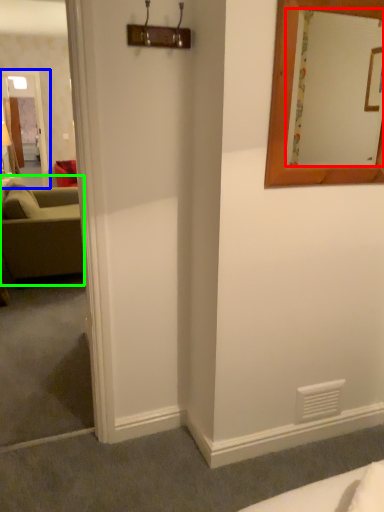
Question: Based on their relative distances, which object is nearer to mirror (highlighted by a red box)? Choose from glass door (highlighted by a blue box) and studio couch (highlighted by a green box).

Choices:
 (A) glass door
 (B) studio couch

Answer: (B)